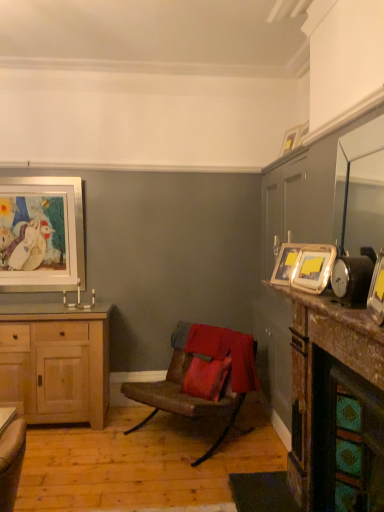
Question: Is light wood cabinet at left located within marble fireplace at right, acting as the 1th counter top starting from the bottom?

Choices:
 (A) yes
 (B) no

Answer: (B)

Question: From a real-world perspective, is marble fireplace at right, acting as the 1th counter top starting from the bottom, over light wood cabinet at left?

Choices:
 (A) no
 (B) yes

Answer: (B)

Question: Considering the relative sizes of marble fireplace at right, acting as the 1th counter top starting from the bottom, and light wood cabinet at left in the image provided, is marble fireplace at right, acting as the 1th counter top starting from the bottom, shorter than light wood cabinet at left?

Choices:
 (A) no
 (B) yes

Answer: (A)

Question: Can you confirm if marble fireplace at right, marked as the 2th counter top in a top-to-bottom arrangement, is taller than light wood cabinet at left?

Choices:
 (A) no
 (B) yes

Answer: (B)

Question: Is marble fireplace at right, marked as the 2th counter top in a top-to-bottom arrangement, at the left side of light wood cabinet at left?

Choices:
 (A) yes
 (B) no

Answer: (B)

Question: Is gold metallic picture frame at upper right, positioned as the 3th picture frame in back-to-front order, wider or thinner than marble fireplace at right, marked as the 2th counter top in a top-to-bottom arrangement?

Choices:
 (A) thin
 (B) wide

Answer: (A)

Question: Is gold metallic picture frame at upper right, which is counted as the 3th picture frame, starting from the front, bigger or smaller than marble fireplace at right, acting as the 1th counter top starting from the bottom?

Choices:
 (A) small
 (B) big

Answer: (A)

Question: From a real-world perspective, is gold metallic picture frame at upper right, which is counted as the 3th picture frame, starting from the front, physically located above or below marble fireplace at right, marked as the 2th counter top in a top-to-bottom arrangement?

Choices:
 (A) below
 (B) above

Answer: (B)

Question: Is gold metallic picture frame at upper right, which is counted as the 3th picture frame, starting from the front, inside the boundaries of marble fireplace at right, acting as the 1th counter top starting from the bottom, or outside?

Choices:
 (A) inside
 (B) outside

Answer: (B)

Question: From a real-world perspective, is matte white picture frame at upper left, the 1th picture frame when ordered from left to right, positioned above or below marble fireplace at right, marked as the 2th counter top in a top-to-bottom arrangement?

Choices:
 (A) above
 (B) below

Answer: (A)

Question: In terms of size, does matte white picture frame at upper left, the 1th picture frame when ordered from left to right, appear bigger or smaller than marble fireplace at right, acting as the 1th counter top starting from the bottom?

Choices:
 (A) big
 (B) small

Answer: (B)

Question: Is point (61, 244) positioned closer to the camera than point (372, 335)?

Choices:
 (A) farther
 (B) closer

Answer: (A)

Question: Is matte white picture frame at upper left, which is the 5th picture frame from right to left, taller or shorter than marble fireplace at right, acting as the 1th counter top starting from the bottom?

Choices:
 (A) short
 (B) tall

Answer: (A)

Question: Considering the positions of light wood cabinet at left and matte gold picture frame at right, the third picture frame positioned from the left, in the image, is light wood cabinet at left taller or shorter than matte gold picture frame at right, the third picture frame positioned from the left,?

Choices:
 (A) short
 (B) tall

Answer: (B)

Question: Considering the relative positions of light wood cabinet at left and matte gold picture frame at right, which appears as the fourth picture frame when viewed from the back, in the image provided, is light wood cabinet at left to the left or to the right of matte gold picture frame at right, which appears as the fourth picture frame when viewed from the back,?

Choices:
 (A) right
 (B) left

Answer: (B)